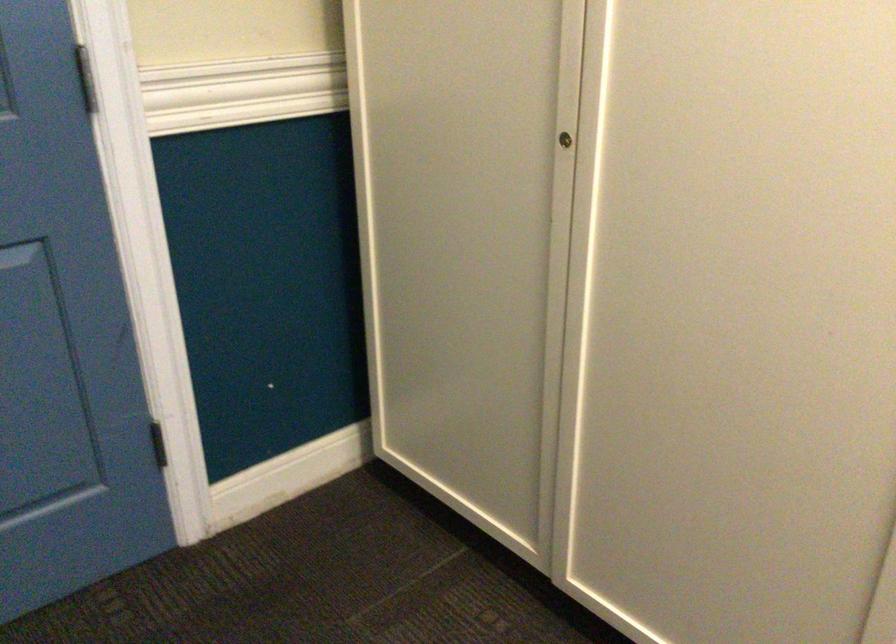
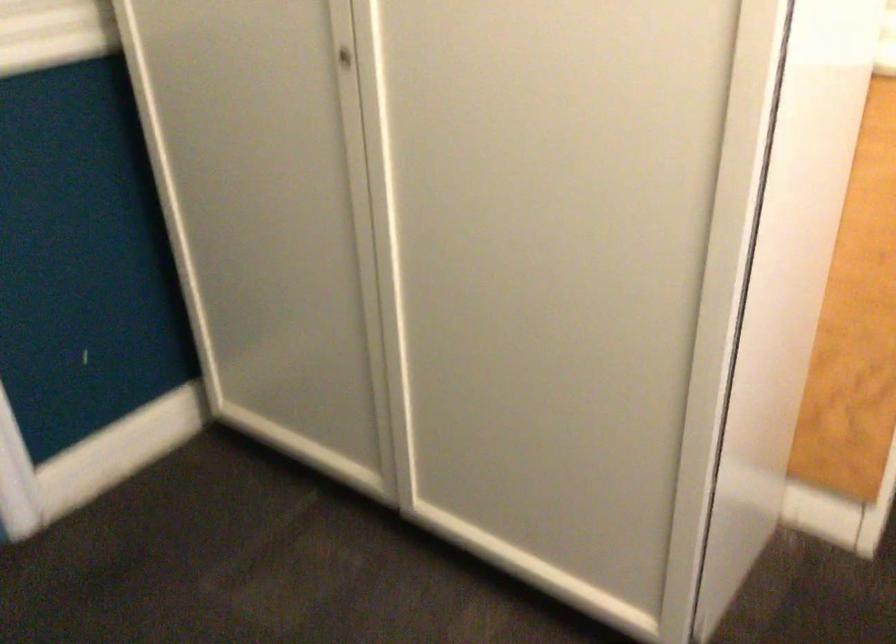
Question: Which direction would the cameraman need to move to produce the second image? Reply with the corresponding letter.

Choices:
 (A) Left
 (B) Right
 (C) Forward
 (D) Backward

Answer: (B)